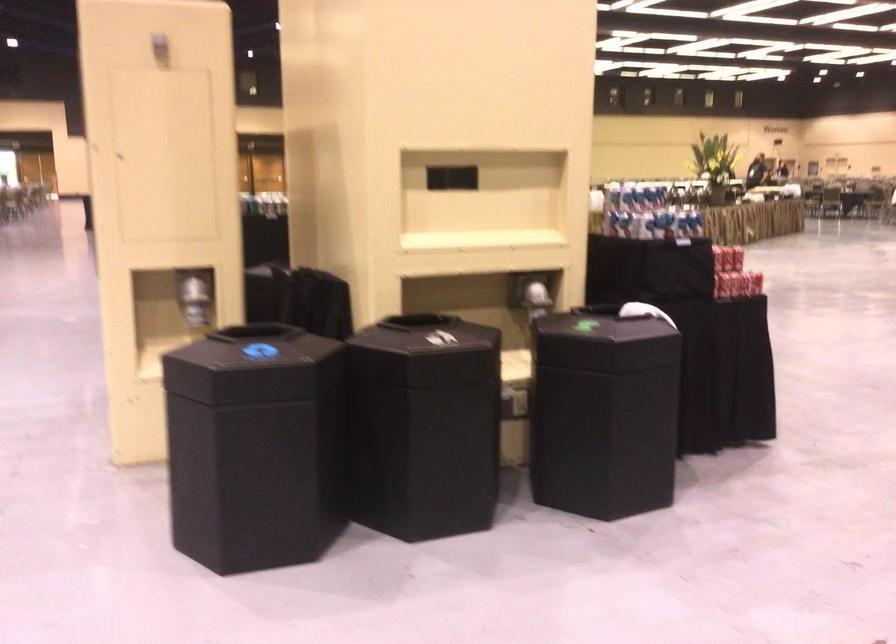
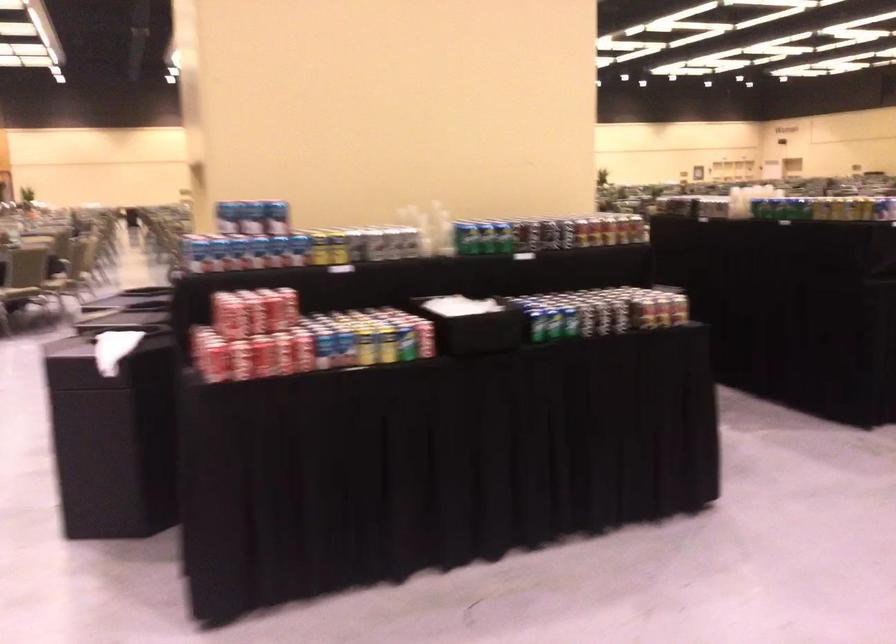
Question: I am providing you with two images of the same scene from different viewpoints. After the viewpoint changes to image2, which objects are now occluded?

Choices:
 (A) blue soda can
 (B) black bin lid
 (C) colorful striped cup
 (D) yellow soda can

Answer: (B)